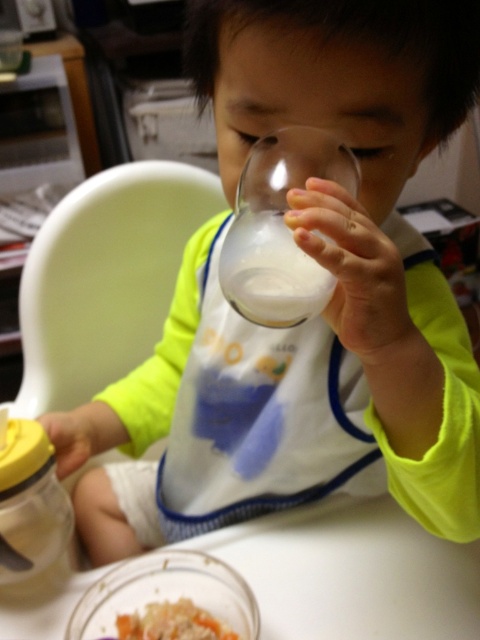
Between yellow matte bottle at lower left and smooth brown rice at lower center, which one is positioned higher?

yellow matte bottle at lower left is above.

Between point (10, 488) and point (181, 596), which one is positioned behind?

The point (181, 596) is behind.

Identify the location of yellow matte bottle at lower left. (33, 515).

At what (x,y) coordinates should I click in order to perform the action: click on yellow matte bottle at lower left. Please return your answer as a coordinate pair (x, y). The width and height of the screenshot is (480, 640). Looking at the image, I should click on (33, 515).

Between white plastic table at lower center and yellow matte bottle at lower left, which one has less height?

white plastic table at lower center is shorter.

The height and width of the screenshot is (640, 480). Describe the element at coordinates (352, 572) in the screenshot. I see `white plastic table at lower center` at that location.

Is point (446, 577) positioned behind point (41, 508)?

Yes, it is behind point (41, 508).

Find the location of a particular element. This screenshot has height=640, width=480. white plastic table at lower center is located at coordinates (352, 572).

Who is more distant from viewer, (x=405, y=520) or (x=196, y=630)?

The point (x=405, y=520) is behind.

In the scene shown: Is white plastic table at lower center taller than smooth brown rice at lower center?

Yes, white plastic table at lower center is taller than smooth brown rice at lower center.

Image resolution: width=480 pixels, height=640 pixels. What do you see at coordinates (352, 572) in the screenshot?
I see `white plastic table at lower center` at bounding box center [352, 572].

You are a GUI agent. You are given a task and a screenshot of the screen. Output one action in this format:
    pyautogui.click(x=<x>, y=<y>)
    Task: Click on the white plastic table at lower center
    Image resolution: width=480 pixels, height=640 pixels.
    Given the screenshot: What is the action you would take?
    pyautogui.click(x=352, y=572)